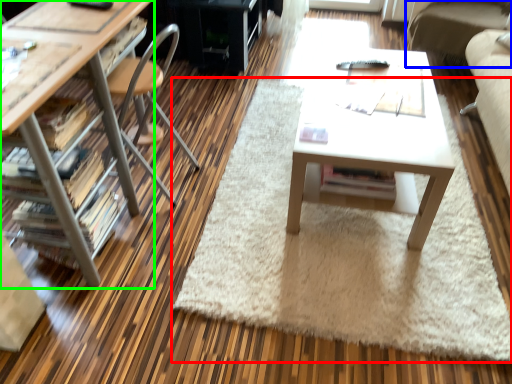
Question: Considering the real-world distances, which object is farthest from mat (highlighted by a red box)? couch (highlighted by a blue box) or desk (highlighted by a green box)?

Choices:
 (A) couch
 (B) desk

Answer: (A)